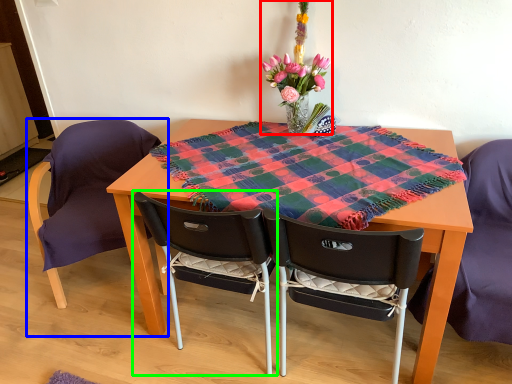
Question: Considering the real-world distances, which object is closest to floral arrangement (highlighted by a red box)? chair (highlighted by a blue box) or chair (highlighted by a green box).

Choices:
 (A) chair
 (B) chair

Answer: (B)